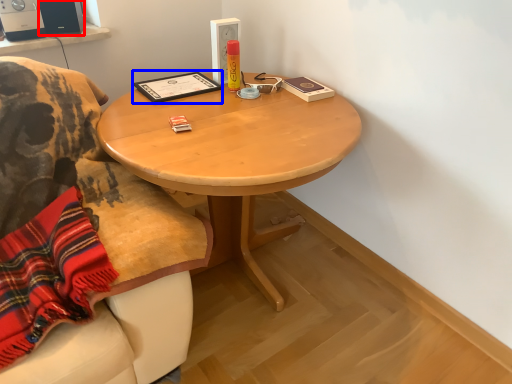
Question: Which of the following is the farthest to the observer, loudspeaker (highlighted by a red box) or book (highlighted by a blue box)?

Choices:
 (A) loudspeaker
 (B) book

Answer: (A)